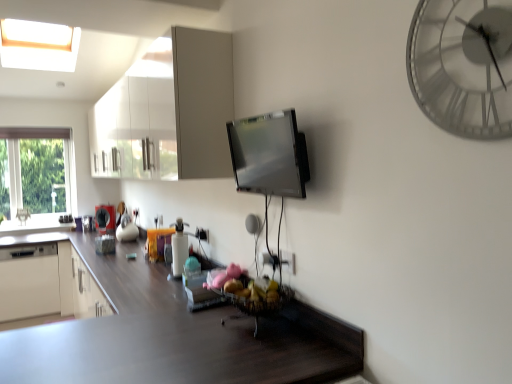
Question: From a real-world perspective, is white glossy bottle at center, the 3th appliance when ordered from left to right, on white glossy cabinet at upper center?

Choices:
 (A) yes
 (B) no

Answer: (B)

Question: Considering the relative sizes of white glossy bottle at center, the second appliance when ordered from bottom to top, and white glossy cabinet at upper center in the image provided, is white glossy bottle at center, the second appliance when ordered from bottom to top, smaller than white glossy cabinet at upper center?

Choices:
 (A) no
 (B) yes

Answer: (B)

Question: Is white glossy bottle at center, the second appliance when ordered from bottom to top, closer to camera compared to white glossy cabinet at upper center?

Choices:
 (A) no
 (B) yes

Answer: (A)

Question: Could you tell me if white glossy bottle at center, the 3th appliance when ordered from left to right, is turned towards white glossy cabinet at upper center?

Choices:
 (A) no
 (B) yes

Answer: (A)

Question: Can you confirm if white glossy bottle at center, the 3th appliance when ordered from left to right, is positioned to the right of white glossy cabinet at upper center?

Choices:
 (A) no
 (B) yes

Answer: (B)

Question: From the image's perspective, is matte black kettle at left, placed as the 3th appliance when sorted from right to left, above or below white glossy cabinet at upper center?

Choices:
 (A) below
 (B) above

Answer: (A)

Question: Considering the positions of point (99, 215) and point (178, 46), is point (99, 215) closer or farther from the camera than point (178, 46)?

Choices:
 (A) farther
 (B) closer

Answer: (A)

Question: Is matte black kettle at left, the 2th appliance from the top, taller or shorter than white glossy cabinet at upper center?

Choices:
 (A) tall
 (B) short

Answer: (B)

Question: From a real-world perspective, is matte black kettle at left, which is counted as the first appliance, starting from the back, positioned above or below white glossy cabinet at upper center?

Choices:
 (A) above
 (B) below

Answer: (B)

Question: In terms of size, does white glossy cabinet at upper center appear bigger or smaller than satin silver tv at center, which is the 1th appliance in front-to-back order?

Choices:
 (A) small
 (B) big

Answer: (B)

Question: Is point (92, 119) closer or farther from the camera than point (245, 148)?

Choices:
 (A) closer
 (B) farther

Answer: (B)

Question: From the image's perspective, relative to satin silver tv at center, placed as the 1th appliance when sorted from top to bottom, is white glossy cabinet at upper center above or below?

Choices:
 (A) below
 (B) above

Answer: (B)

Question: Is white glossy cabinet at upper center in front of or behind satin silver tv at center, which is the 1th appliance in front-to-back order, in the image?

Choices:
 (A) behind
 (B) front

Answer: (A)

Question: From a real-world perspective, is metallic silver clock at upper right physically located above or below white glossy cabinet at upper center?

Choices:
 (A) above
 (B) below

Answer: (B)

Question: Is metallic silver clock at upper right bigger or smaller than white glossy cabinet at upper center?

Choices:
 (A) small
 (B) big

Answer: (A)